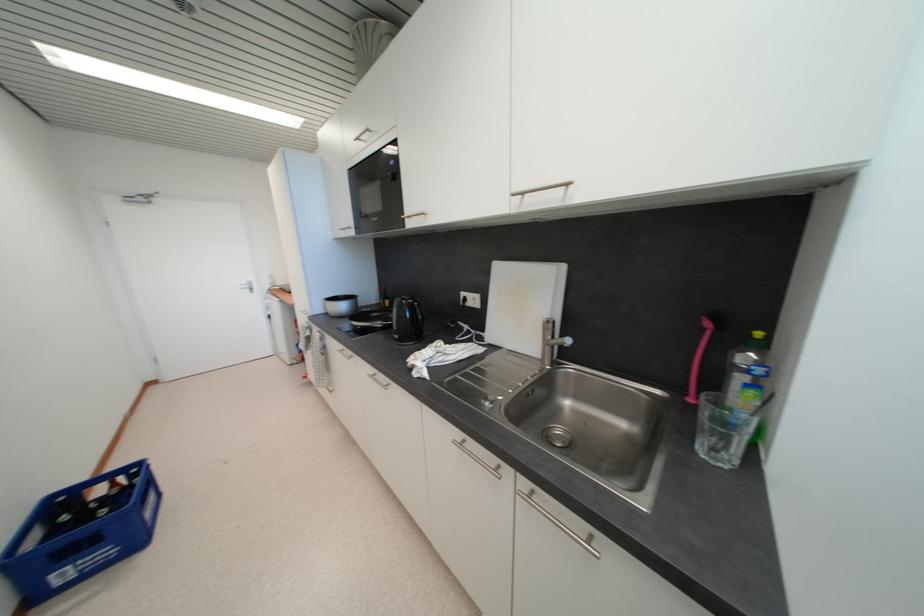
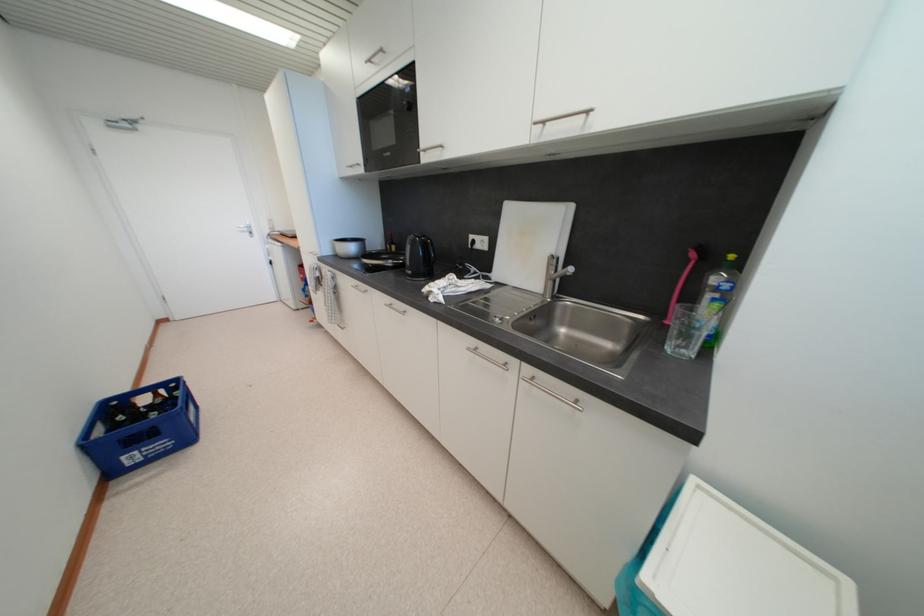
Locate, in the second image, the point that corresponds to pixel 402 339 in the first image.

(415, 275)